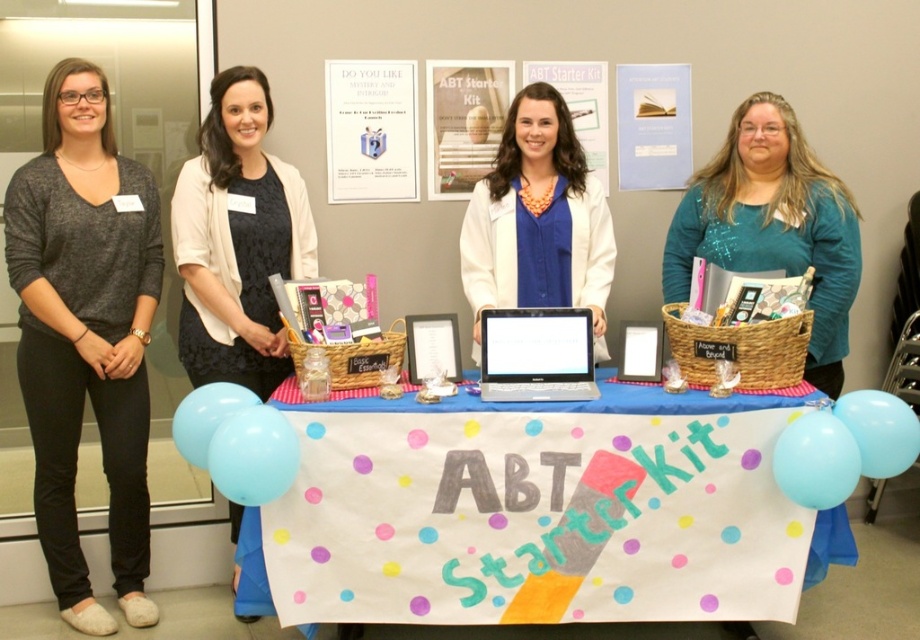
You are a customer at the event and want to pick up the light blue balloon at lower left. Is the teal glittery sweater at center in your way?

The teal glittery sweater at center is above the light blue balloon at lower left, so it is not blocking the balloon. You can reach the light blue balloon at lower left without moving the sweater.

You are organizing a school fair and need to set up a booth similar to the one shown. You have a silver metallic laptop at center and a light blue balloon at lower right. Which object is shorter when viewed from the front?

The silver metallic laptop at center is shorter than the light blue balloon at lower right.

What are the coordinates of the matte gray sweater at left?

The coordinates of the matte gray sweater at left are at point (85, 333).